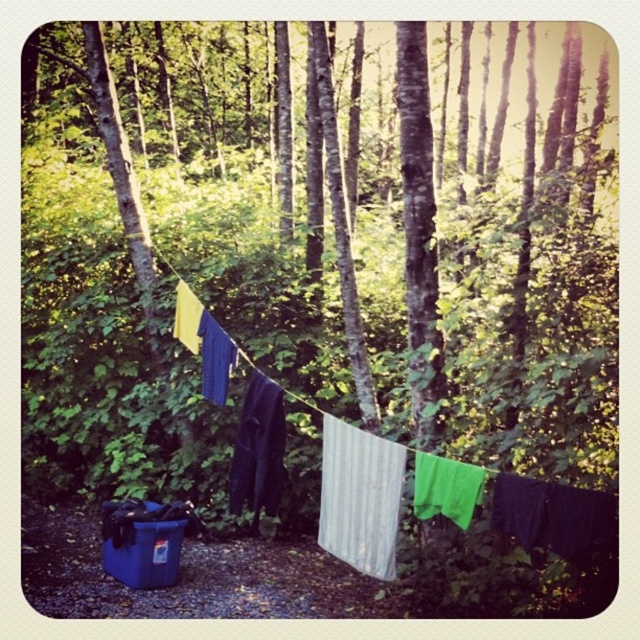
Measure the distance from white corrugated plastic at center to dark blue fabric at center.

The distance of white corrugated plastic at center from dark blue fabric at center is 25.26 inches.

Is point (372, 484) positioned behind point (266, 477)?

That is False.

Find the location of a particular element. This screenshot has height=640, width=640. white corrugated plastic at center is located at coordinates (358, 497).

Is point (141, 540) in front of point (284, 429)?

No, it is not.

Is blue plastic cooler at lower left wider than dark blue fabric at center?

Correct, the width of blue plastic cooler at lower left exceeds that of dark blue fabric at center.

Where is `blue plastic cooler at lower left`? blue plastic cooler at lower left is located at coordinates click(x=145, y=540).

Image resolution: width=640 pixels, height=640 pixels. In order to click on blue plastic cooler at lower left in this screenshot , I will do `click(145, 540)`.

Is point (324, 476) farther from camera compared to point (140, 556)?

No, (324, 476) is in front of (140, 556).

Locate an element on the screen. The width and height of the screenshot is (640, 640). white corrugated plastic at center is located at coordinates (358, 497).